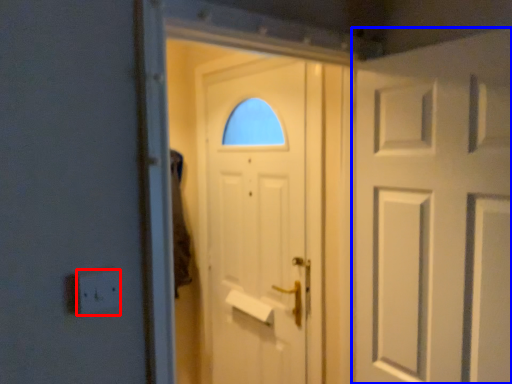
Question: Which of the following is the farthest to the observer, electric outlet (highlighted by a red box) or door (highlighted by a blue box)?

Choices:
 (A) electric outlet
 (B) door

Answer: (B)